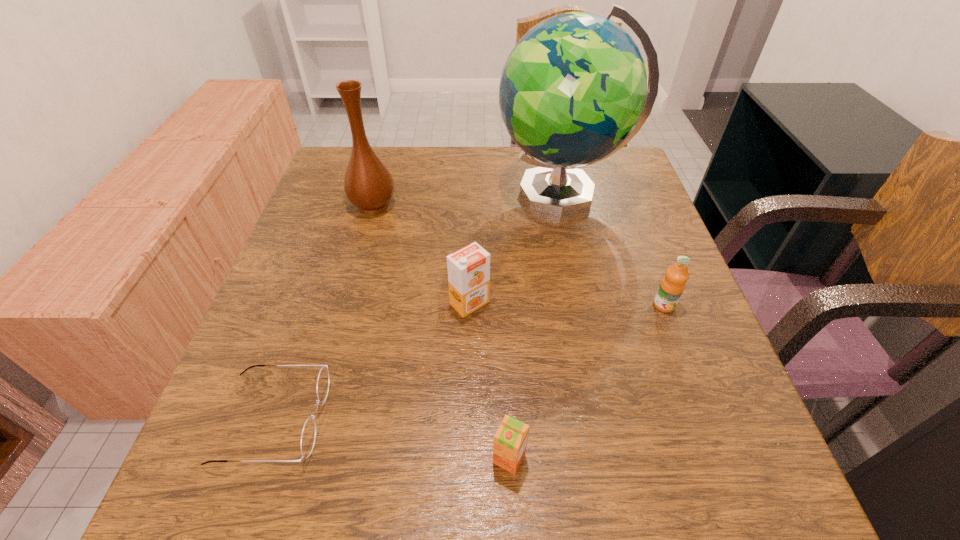
This screenshot has width=960, height=540. Find the location of `the tallest object`. the tallest object is located at coordinates (573, 91).

Identify the location of the fifth shortest object. (368, 184).

Where is `the rightmost orange juice`? Image resolution: width=960 pixels, height=540 pixels. the rightmost orange juice is located at coordinates (672, 285).

Identify the location of the nearest orange juice. Image resolution: width=960 pixels, height=540 pixels. (510, 440).

You are a GUI agent. You are given a task and a screenshot of the screen. Output one action in this format:
    pyautogui.click(x=<x>, y=<y>)
    Task: Click on the shortest orange juice
    Image resolution: width=960 pixels, height=540 pixels.
    Given the screenshot: What is the action you would take?
    pyautogui.click(x=510, y=440)

Locate an element on the screen. This screenshot has width=960, height=540. spectacles is located at coordinates (309, 432).

Where is `vacant space positioned on the front surface of the tallest object`? vacant space positioned on the front surface of the tallest object is located at coordinates (355, 193).

This screenshot has height=540, width=960. Find the location of `blank space located 0.310m on the front surface of the tallest object`. blank space located 0.310m on the front surface of the tallest object is located at coordinates (378, 193).

The height and width of the screenshot is (540, 960). In order to click on free space located on the front surface of the tallest object in this screenshot , I will do `click(400, 193)`.

Image resolution: width=960 pixels, height=540 pixels. I want to click on blank area located 0.190m on the front of the vase, so click(x=354, y=275).